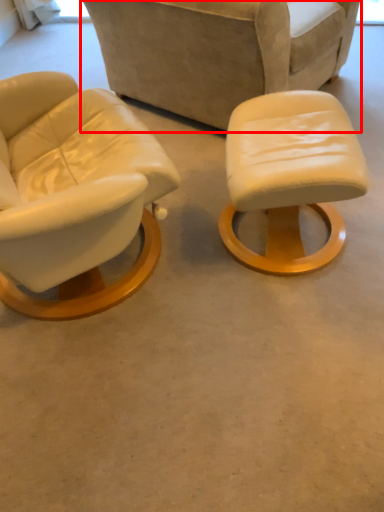
Question: From the image's perspective, where is chair (annotated by the red box) located in relation to stool in the image?

Choices:
 (A) below
 (B) above

Answer: (B)